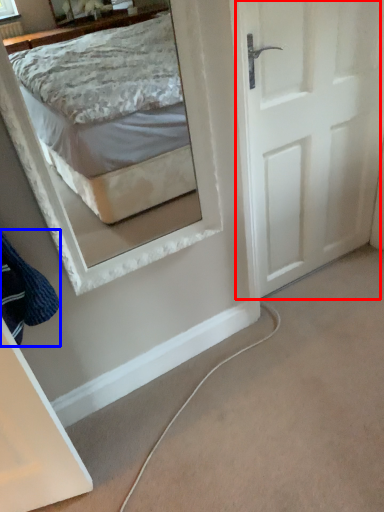
Question: Which object is further to the camera taking this photo, door (highlighted by a red box) or clothe (highlighted by a blue box)?

Choices:
 (A) door
 (B) clothe

Answer: (A)